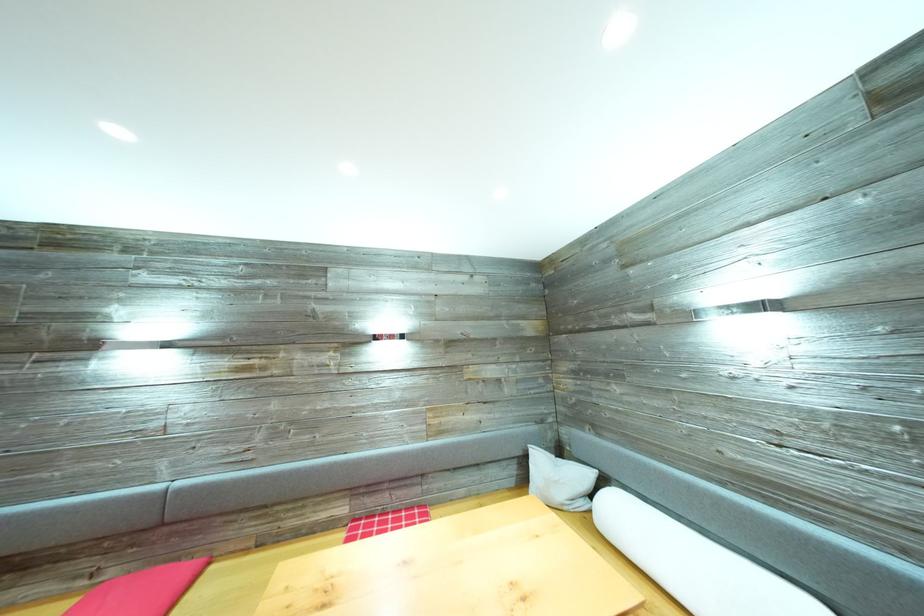
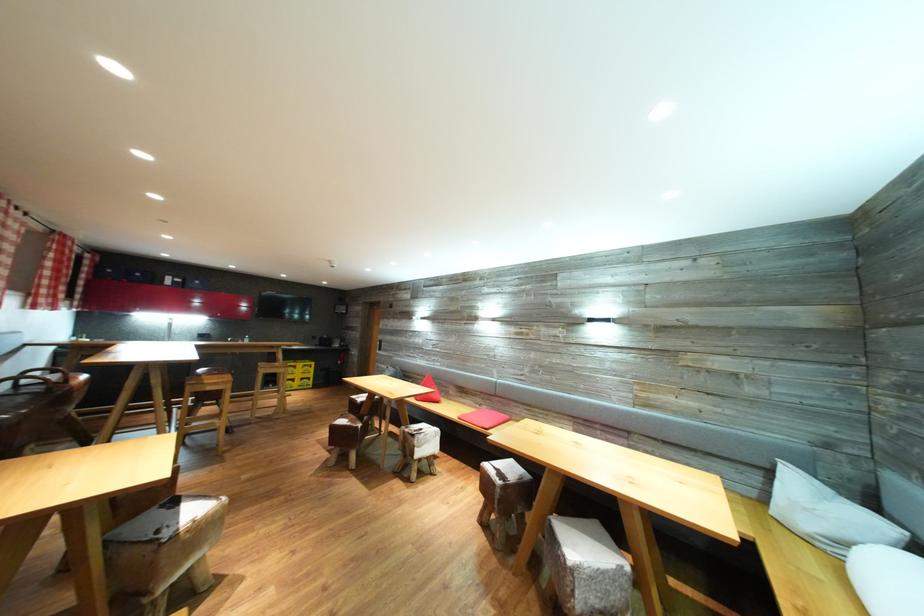
Question: The camera is either moving clockwise (left) or counter-clockwise (right) around the object. The first image is from the beginning of the video and the second image is from the end. Is the camera moving left or right when shooting the video?

Choices:
 (A) Left
 (B) Right

Answer: (B)